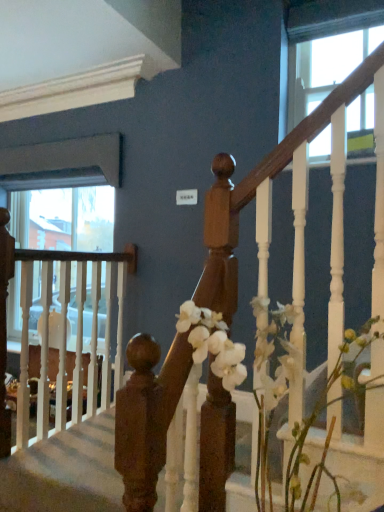
The image size is (384, 512). Describe the element at coordinates (65, 472) in the screenshot. I see `wooden handrail at center` at that location.

Locate an element on the screen. clear glass window at upper right is located at coordinates (325, 63).

In order to click on floral arrangement on the left of clear glass window at upper right in this screenshot , I will do `click(269, 384)`.

Would you say white matte flowers at center is a long distance from clear glass window at upper right?

white matte flowers at center is positioned a significant distance from clear glass window at upper right.

Does white matte flowers at center appear on the right side of clear glass window at upper right?

No, white matte flowers at center is not to the right of clear glass window at upper right.

From a real-world perspective, relative to clear glass window at upper right, is white matte flowers at center vertically above or below?

white matte flowers at center is situated lower than clear glass window at upper right in the real world.

Between wooden handrail at center and white matte flowers at center, which one has more height?

white matte flowers at center.

Is wooden handrail at center located outside white matte flowers at center?

Indeed, wooden handrail at center is completely outside white matte flowers at center.

Identify the location of floral arrangement above the wooden handrail at center (from the image's perspective). Image resolution: width=384 pixels, height=512 pixels. (269, 384).

From the image's perspective, is wooden handrail at center on top of white matte flowers at center?

No.

Is clear glass window at upper right at the back of wooden handrail at center?

That's not correct — wooden handrail at center is not looking away from clear glass window at upper right.

Looking at the image, does wooden handrail at center seem bigger or smaller compared to clear glass window at upper right?

Considering their sizes, wooden handrail at center takes up more space than clear glass window at upper right.

Consider the image. Does wooden handrail at center appear on the right side of clear glass window at upper right?

No, wooden handrail at center is not to the right of clear glass window at upper right.

From a real-world perspective, who is located lower, white matte flowers at center or wooden handrail at center?

wooden handrail at center is physically lower.

Who is shorter, white matte flowers at center or wooden handrail at center?

wooden handrail at center is shorter.

How many degrees apart are the facing directions of white matte flowers at center and wooden handrail at center?

0.461 degrees separate the facing orientations of white matte flowers at center and wooden handrail at center.

Looking at this image, is white matte flowers at center wider than wooden handrail at center?

In fact, white matte flowers at center might be narrower than wooden handrail at center.

From the picture: Who is taller, clear glass window at upper right or wooden handrail at center?

Standing taller between the two is clear glass window at upper right.

Can you confirm if clear glass window at upper right is positioned to the left of wooden handrail at center?

In fact, clear glass window at upper right is to the right of wooden handrail at center.

Would you say clear glass window at upper right is a long distance from wooden handrail at center?

Yes, clear glass window at upper right and wooden handrail at center are located far from each other.

Is clear glass window at upper right facing towards wooden handrail at center?

No, clear glass window at upper right is not facing towards wooden handrail at center.

Does clear glass window at upper right touch white matte flowers at center?

No.

Does clear glass window at upper right have a smaller size compared to white matte flowers at center?

Indeed, clear glass window at upper right has a smaller size compared to white matte flowers at center.

Which object is closer to the camera, clear glass window at upper right or white matte flowers at center?

white matte flowers at center is in front.

How far apart are clear glass window at upper right and white matte flowers at center?

5.82 feet.

Find the location of a particular element. This screenshot has width=384, height=512. window on the right of the white matte flowers at center is located at coordinates (325, 63).

This screenshot has width=384, height=512. Find the location of `stairwell below the white matte flowers at center (from a real-world perspective)`. stairwell below the white matte flowers at center (from a real-world perspective) is located at coordinates (65, 472).

Looking at the image, which one is located closer to wooden handrail at center, clear glass window at upper right or white matte flowers at center?

Among the two, white matte flowers at center is located nearer to wooden handrail at center.

When comparing their distances from clear glass window at upper right, does wooden handrail at center or white matte flowers at center seem further?

The object further to clear glass window at upper right is wooden handrail at center.

Estimate the real-world distances between objects in this image. Which object is closer to wooden handrail at center, white matte flowers at center or clear glass window at upper right?

white matte flowers at center lies closer to wooden handrail at center than the other object.

In the scene shown: Which object lies nearer to the anchor point white matte flowers at center, wooden handrail at center or clear glass window at upper right?

wooden handrail at center is positioned closer to the anchor white matte flowers at center.

Looking at the image, which one is located closer to clear glass window at upper right, white matte flowers at center or wooden handrail at center?

The object closer to clear glass window at upper right is white matte flowers at center.

From the image, which object appears to be farther from white matte flowers at center, clear glass window at upper right or wooden handrail at center?

The object further to white matte flowers at center is clear glass window at upper right.

Locate an element on the screen. The height and width of the screenshot is (512, 384). floral arrangement between clear glass window at upper right and wooden handrail at center from top to bottom is located at coordinates (269, 384).